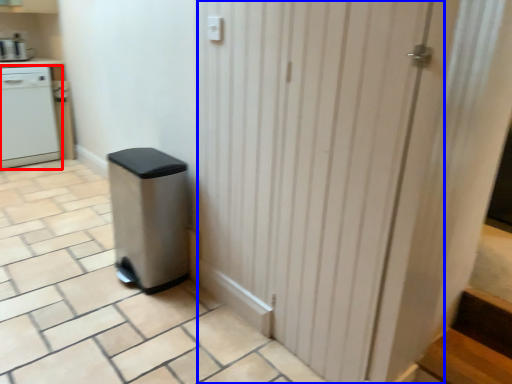
Question: Which point is closer to the camera, home appliance (highlighted by a red box) or screen door (highlighted by a blue box)?

Choices:
 (A) home appliance
 (B) screen door

Answer: (B)